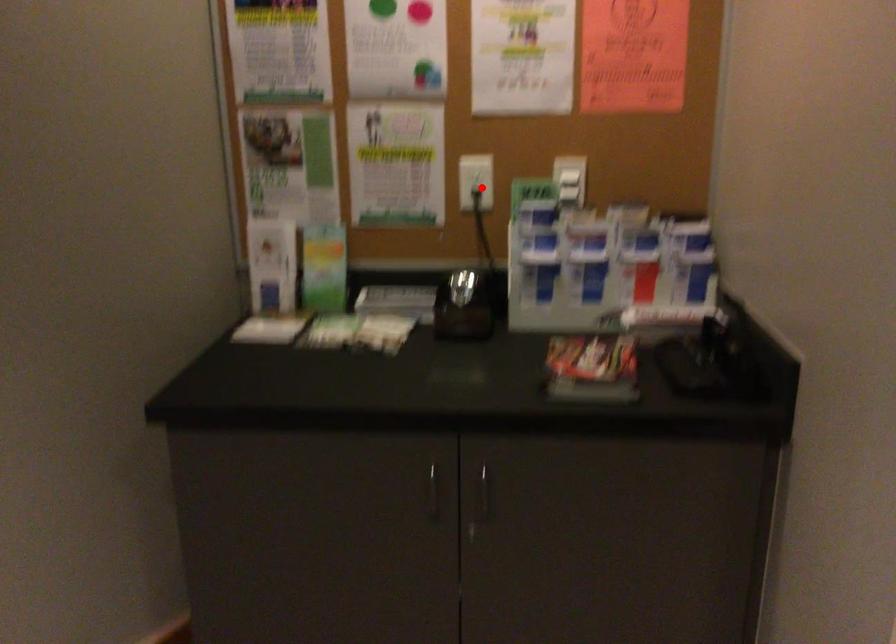
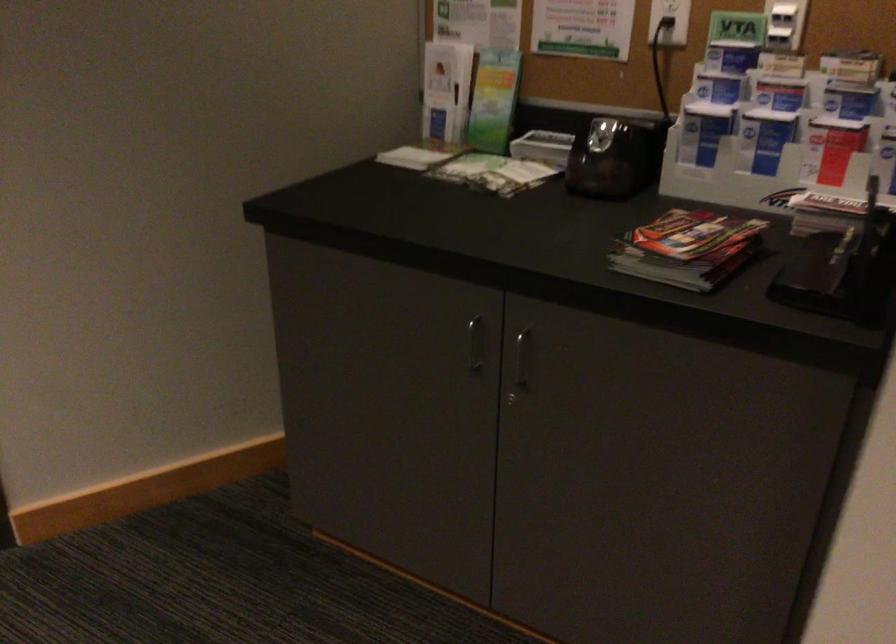
Question: I am providing you with two images of the same scene from different viewpoints. A red point is shown in image1. For the corresponding object point in image2, is it positioned nearer or farther from the camera?

Choices:
 (A) Nearer
 (B) Farther

Answer: (A)